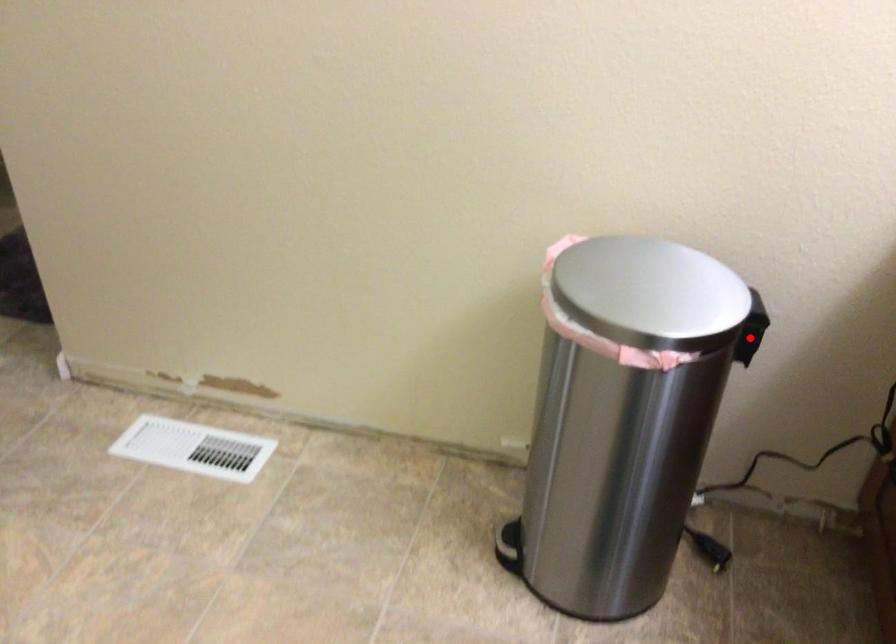
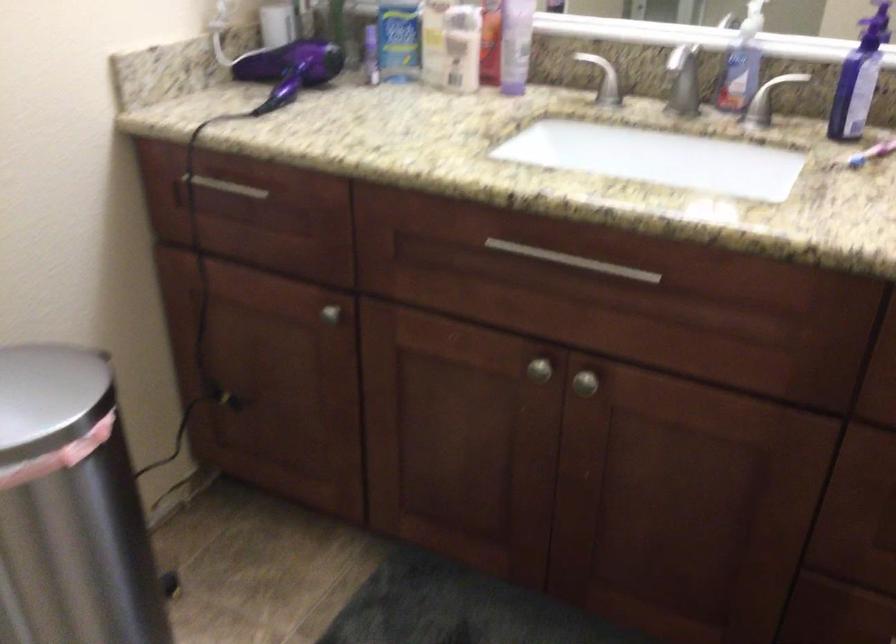
Question: I am providing you with two images of the same scene from different viewpoints. A red point is marked on the first image. At the location where the point appears in image 1, is it still visible in image 2?

Choices:
 (A) Yes
 (B) No

Answer: (B)